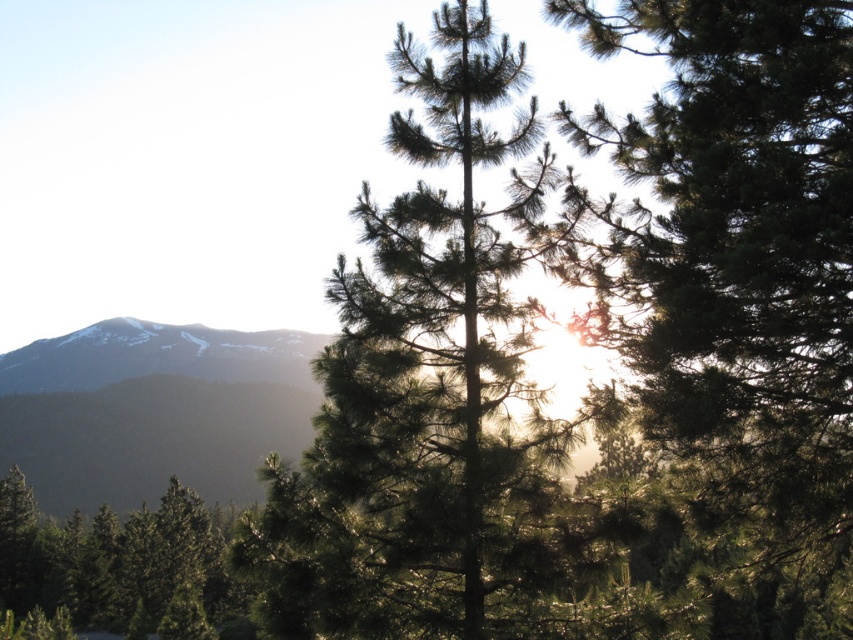
You are planning to take a photo of the smokey gray mountain at left and the green matte tree at lower left. Which object should you focus on first if you want to capture both in a single frame without moving the camera?

You should focus on the smokey gray mountain at left first because it is larger in size than the green matte tree at lower left, so it will require more attention in the frame.